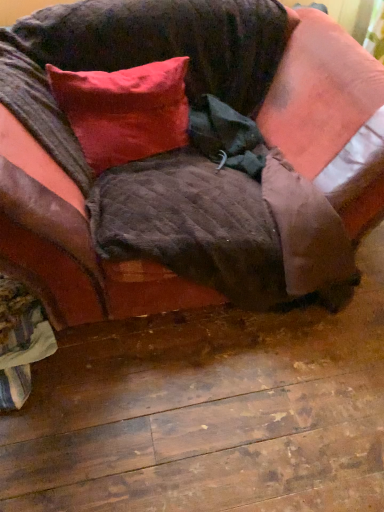
Describe the element at coordinates (71, 244) in the screenshot. I see `velvet brown couch at center` at that location.

Where is `velvet brown couch at center`? velvet brown couch at center is located at coordinates (71, 244).

This screenshot has width=384, height=512. What do you see at coordinates (124, 110) in the screenshot?
I see `satin red pillow at upper left` at bounding box center [124, 110].

Find the location of a particular element. satin red pillow at upper left is located at coordinates (124, 110).

What is the approximate height of satin red pillow at upper left?

satin red pillow at upper left is 29.86 centimeters in height.

I want to click on velvet brown couch at center, so click(71, 244).

Between satin red pillow at upper left and velvet brown couch at center, which one appears on the left side from the viewer's perspective?

satin red pillow at upper left is more to the left.

Considering the positions of objects satin red pillow at upper left and velvet brown couch at center in the image provided, who is behind, satin red pillow at upper left or velvet brown couch at center?

satin red pillow at upper left.

Is point (72, 113) positioned behind point (310, 80)?

That is False.

From the image's perspective, is satin red pillow at upper left below velvet brown couch at center?

No, from the image's perspective, satin red pillow at upper left is not beneath velvet brown couch at center.

Based on the photo, from a real-world perspective, who is located lower, satin red pillow at upper left or velvet brown couch at center?

From a 3D spatial view, velvet brown couch at center is below.

Looking at their sizes, would you say satin red pillow at upper left is wider or thinner than velvet brown couch at center?

satin red pillow at upper left is thinner than velvet brown couch at center.

Between satin red pillow at upper left and velvet brown couch at center, which one has less height?

satin red pillow at upper left.

Is satin red pillow at upper left bigger than velvet brown couch at center?

Incorrect, satin red pillow at upper left is not larger than velvet brown couch at center.

Is satin red pillow at upper left completely or partially outside of velvet brown couch at center?

Actually, satin red pillow at upper left is within velvet brown couch at center.

Based on the photo, does satin red pillow at upper left touch velvet brown couch at center?

No, satin red pillow at upper left is not making contact with velvet brown couch at center.

Is satin red pillow at upper left aimed at velvet brown couch at center?

Yes.

What's the angular difference between satin red pillow at upper left and velvet brown couch at center's facing directions?

They differ by 7.29 degrees in their facing directions.

Measure the distance from satin red pillow at upper left to velvet brown couch at center.

The distance of satin red pillow at upper left from velvet brown couch at center is 20.24 inches.

Identify the location of studio couch that is below the satin red pillow at upper left (from the image's perspective). (71, 244).

Is velvet brown couch at center at the right side of satin red pillow at upper left?

Correct, you'll find velvet brown couch at center to the right of satin red pillow at upper left.

Which object is closer to the camera, velvet brown couch at center or satin red pillow at upper left?

velvet brown couch at center is closer to the camera.

Considering the positions of point (362, 90) and point (134, 68), is point (362, 90) closer or farther from the camera than point (134, 68)?

Point (362, 90) is positioned closer to the camera compared to point (134, 68).

From the image's perspective, which is below, velvet brown couch at center or satin red pillow at upper left?

velvet brown couch at center, from the image's perspective.

From a real-world perspective, between velvet brown couch at center and satin red pillow at upper left, who is vertically lower?

From a 3D spatial view, velvet brown couch at center is below.

Considering the relative sizes of velvet brown couch at center and satin red pillow at upper left in the image provided, is velvet brown couch at center thinner than satin red pillow at upper left?

Incorrect, the width of velvet brown couch at center is not less than that of satin red pillow at upper left.

Does velvet brown couch at center have a lesser height compared to satin red pillow at upper left?

No.

Between velvet brown couch at center and satin red pillow at upper left, which one has smaller size?

satin red pillow at upper left is smaller.

Would you say velvet brown couch at center is outside satin red pillow at upper left?

Yes, velvet brown couch at center is not within satin red pillow at upper left.

Would you consider velvet brown couch at center to be distant from satin red pillow at upper left?

No, velvet brown couch at center is not far away from satin red pillow at upper left.

Is velvet brown couch at center looking in the opposite direction of satin red pillow at upper left?

Yes, velvet brown couch at center is positioned with its back facing satin red pillow at upper left.

Can you tell me how much velvet brown couch at center and satin red pillow at upper left differ in facing direction?

The angular difference between velvet brown couch at center and satin red pillow at upper left is 7.29 degrees.

The width and height of the screenshot is (384, 512). I want to click on studio couch below the satin red pillow at upper left (from the image's perspective), so click(x=71, y=244).

You are a GUI agent. You are given a task and a screenshot of the screen. Output one action in this format:
    pyautogui.click(x=<x>, y=<y>)
    Task: Click on the studio couch in front of the satin red pillow at upper left
    Image resolution: width=384 pixels, height=512 pixels.
    Given the screenshot: What is the action you would take?
    pyautogui.click(x=71, y=244)

Find the location of a particular element. Image resolution: width=384 pixels, height=512 pixels. studio couch that is under the satin red pillow at upper left (from a real-world perspective) is located at coordinates (71, 244).